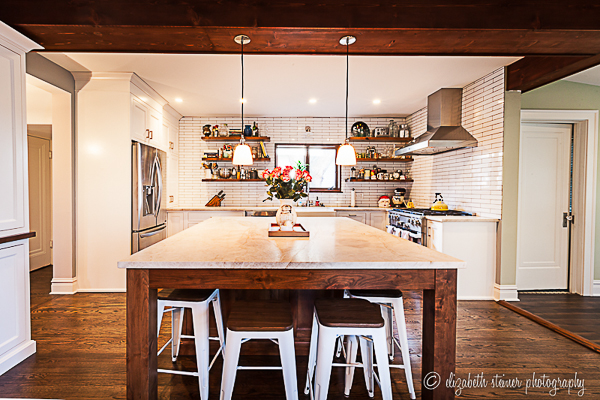
Find the location of a particular element. bar stools is located at coordinates (190, 299), (256, 330), (350, 315), (391, 299).